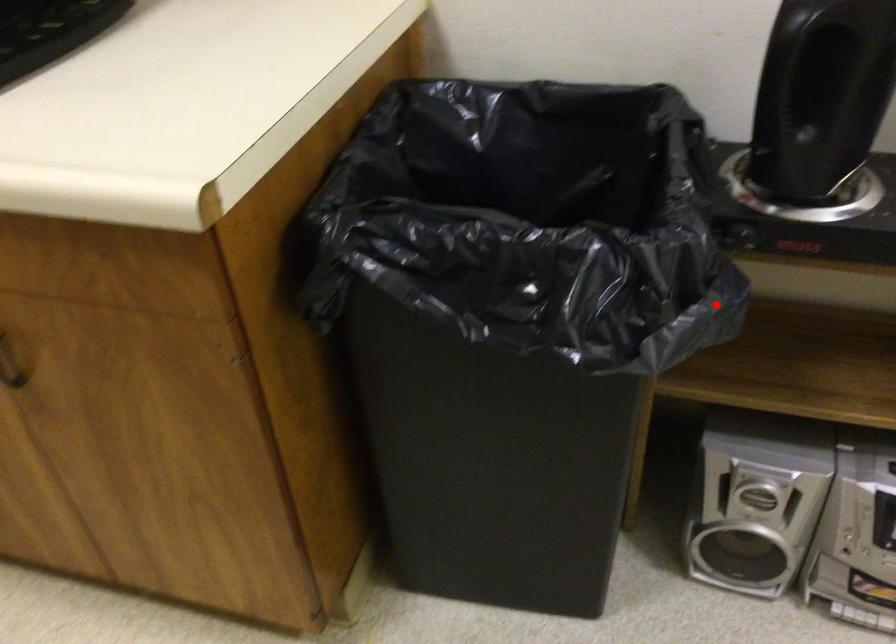
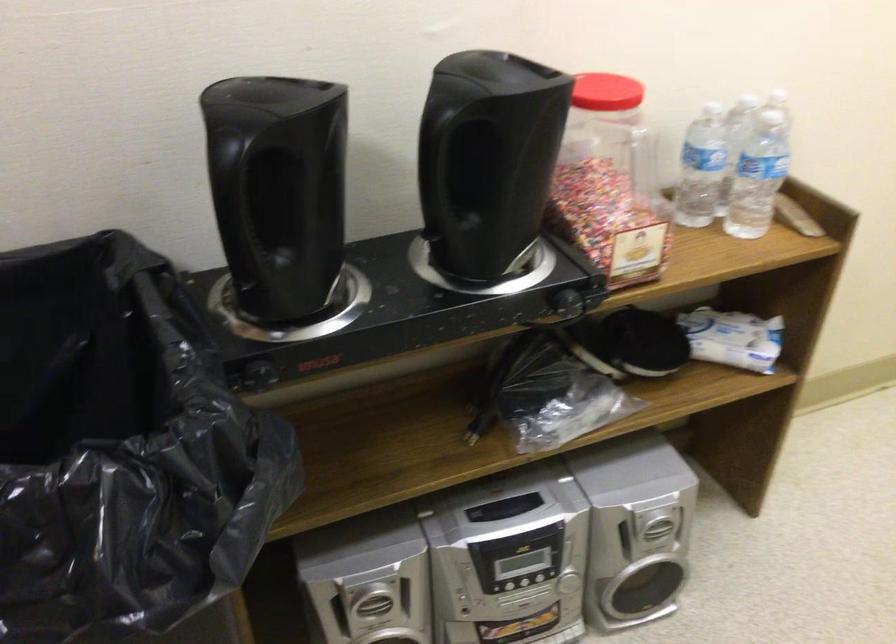
Question: I am providing you with two images of the same scene from different viewpoints. Image1 has a red point marked. In image2, the corresponding 3D location appears at what relative position? Reply with the corresponding letter.

Choices:
 (A) Closer
 (B) Farther

Answer: (A)